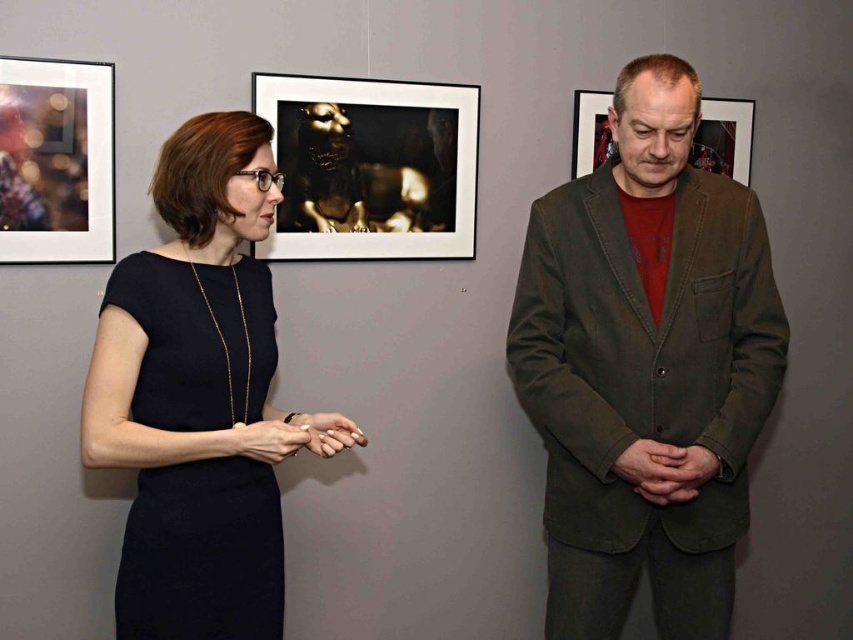
You are standing in the art gallery and want to take a photo of the metallic glass frame at upper left. Where should you position yourself to capture it in the best possible view?

The metallic glass frame at upper left is located at point (55, 161), so you should position yourself directly in front of that coordinate to capture it in the best possible view.

Consider the image. You are a painter who needs to place a new painting that is 2 meters wide between the metallic glass frame at upper left and the matte brown frame at center. Is there enough space?

The distance between the metallic glass frame at upper left and the matte brown frame at center is 1.87 meters, which is less than the 2 meters required for the new painting. Therefore, there is not enough space.

You are an art critic analyzing the spatial arrangement of the displayed items in the gallery. Based on the scene, which object is positioned behind the other between the metallic gold sculpture at upper center and the matte black hand at center?

The matte black hand at center is positioned behind the metallic gold sculpture at upper center.